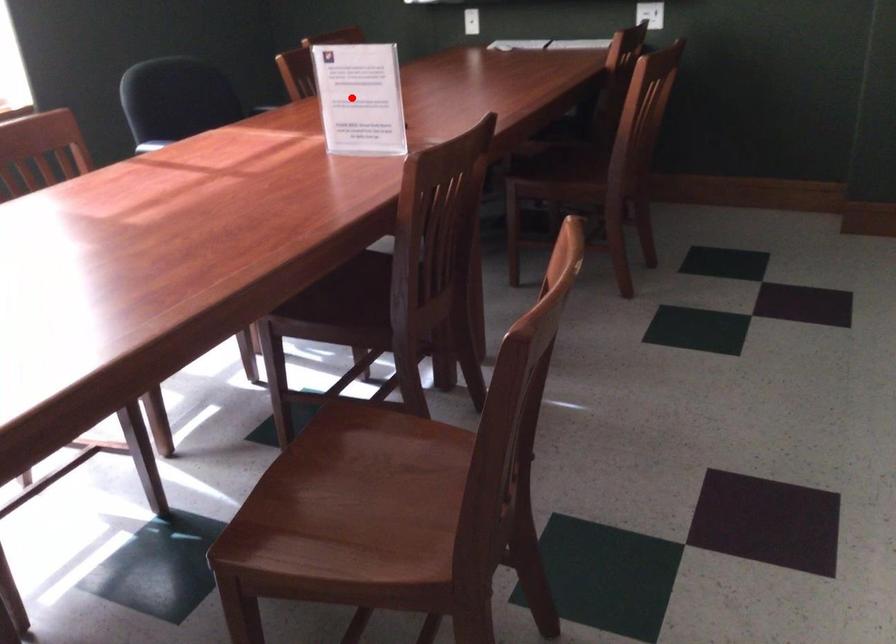
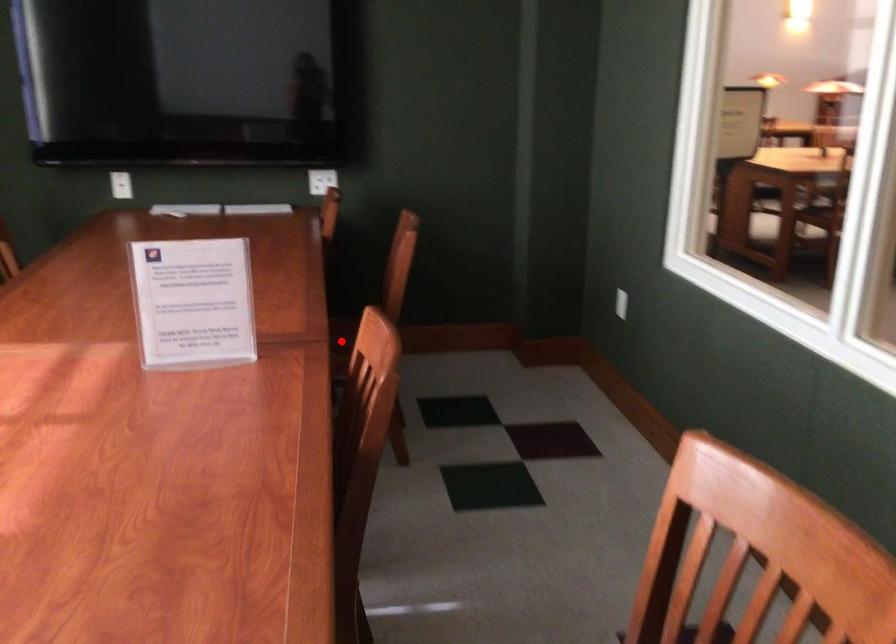
I am providing you with two images of the same scene from different viewpoints. A red point is marked on the first image and another point is marked on the second image. Do the highlighted points in image1 and image2 indicate the same real-world spot?

No